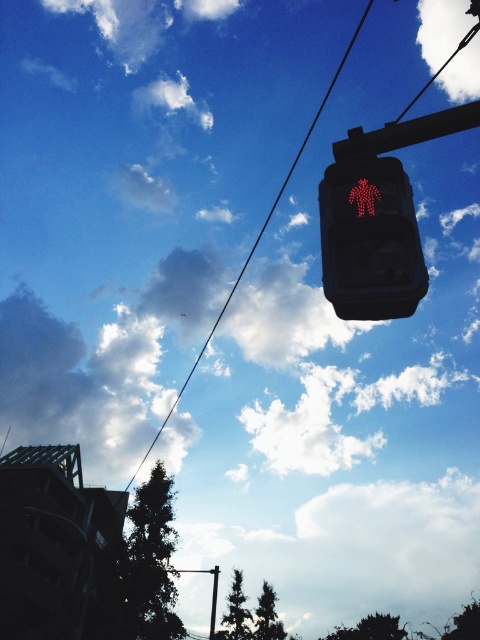
Question: Which object is the closest to the metallic pole at upper center?

Choices:
 (A) black wire at upper center
 (B) red led pedestrian at upper center

Answer: (A)

Question: Observing the image, what is the correct spatial positioning of red led pedestrian at upper center in reference to black wire at upper center?

Choices:
 (A) below
 (B) above

Answer: (A)

Question: Can you confirm if red led pedestrian at upper center is bigger than metallic pole at center?

Choices:
 (A) yes
 (B) no

Answer: (B)

Question: Can you confirm if red led pedestrian at upper center is positioned to the left of metallic pole at upper center?

Choices:
 (A) yes
 (B) no

Answer: (B)

Question: Which point appears closest to the camera in this image?

Choices:
 (A) (193, 364)
 (B) (213, 573)
 (C) (213, 612)
 (D) (348, 172)

Answer: (D)

Question: Which of the following is the farthest from the observer?

Choices:
 (A) red led pedestrian at upper center
 (B) metallic pole at upper center
 (C) metallic pole at center

Answer: (C)